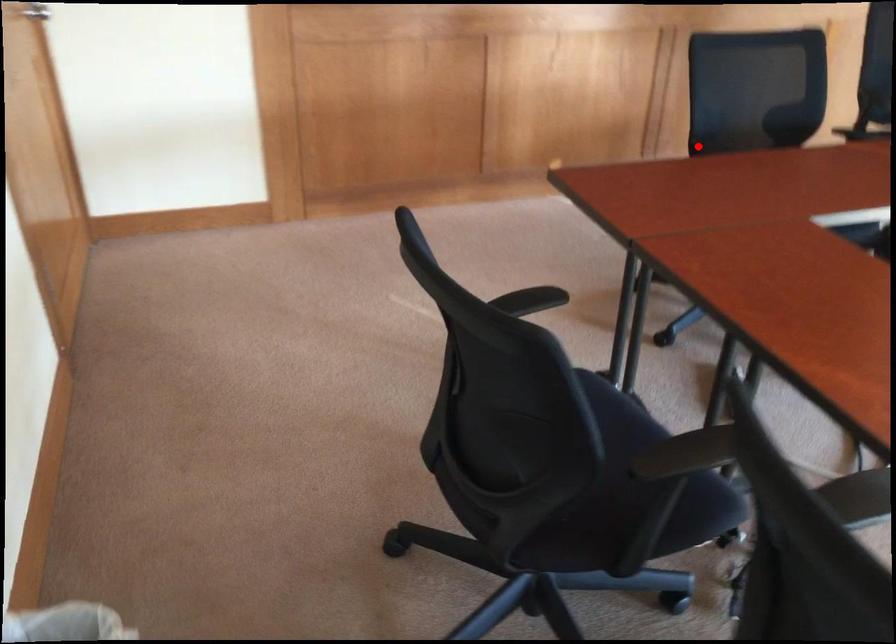
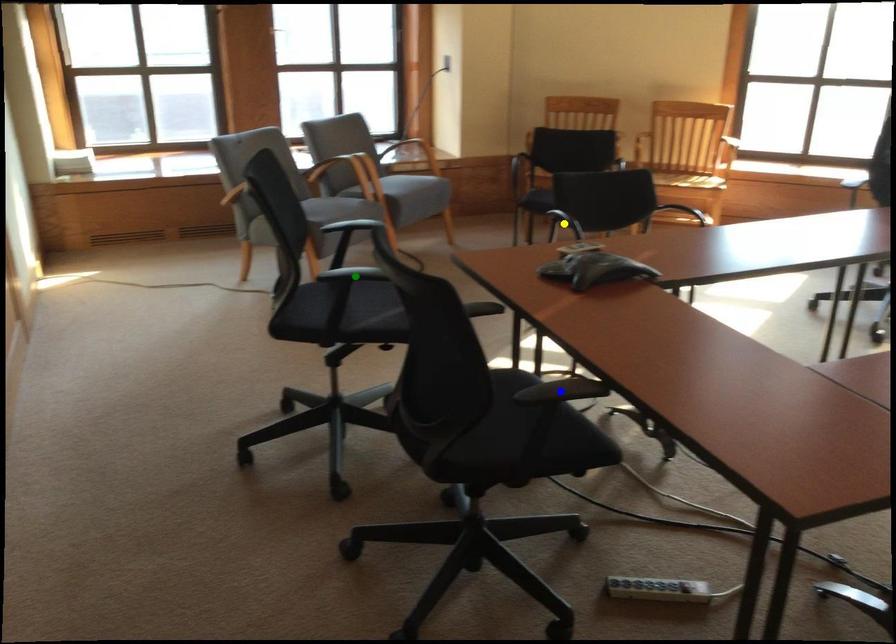
Question: I am providing you with two images of the same scene from different viewpoints. A red point is marked on the first image. You are given multiple points on the second image. In image 2, which mark is for the same physical point as the one in image 1?

Choices:
 (A) green point
 (B) yellow point
 (C) blue point

Answer: (C)